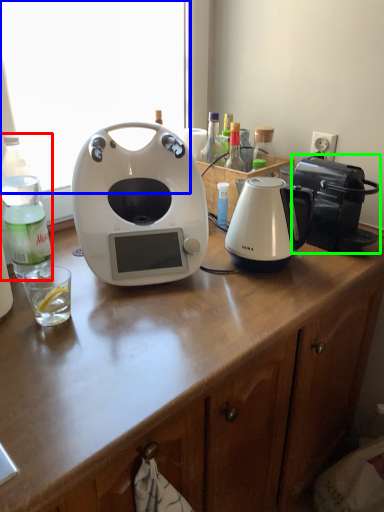
Question: Estimate the real-world distances between objects in this image. Which object is closer to bottle (highlighted by a red box), window screen (highlighted by a blue box) or toaster (highlighted by a green box)?

Choices:
 (A) window screen
 (B) toaster

Answer: (B)